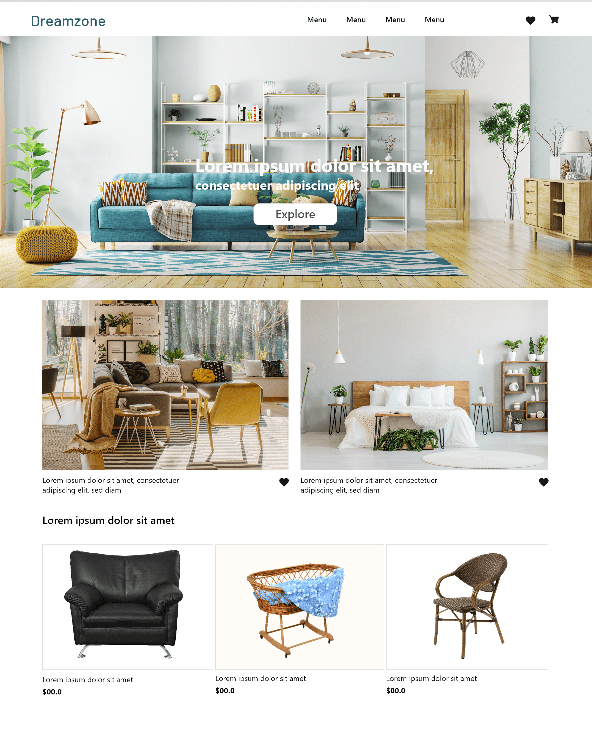
You are a GUI agent. You are given a task and a screenshot of the screen. Output one action in this format:
    pyautogui.click(x=<x>, y=<y>)
    Task: Click on the bed
    
    Given the screenshot: What is the action you would take?
    pyautogui.click(x=431, y=404)